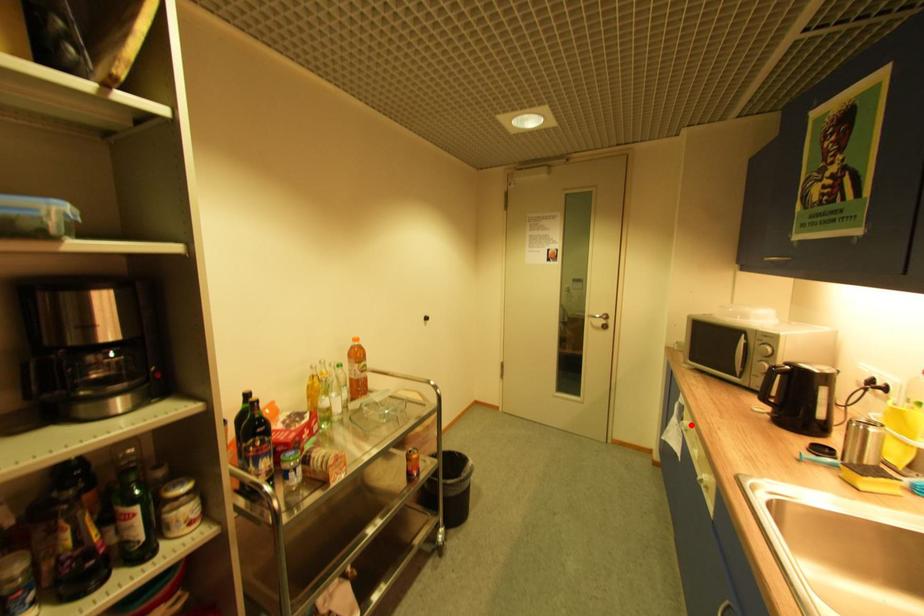
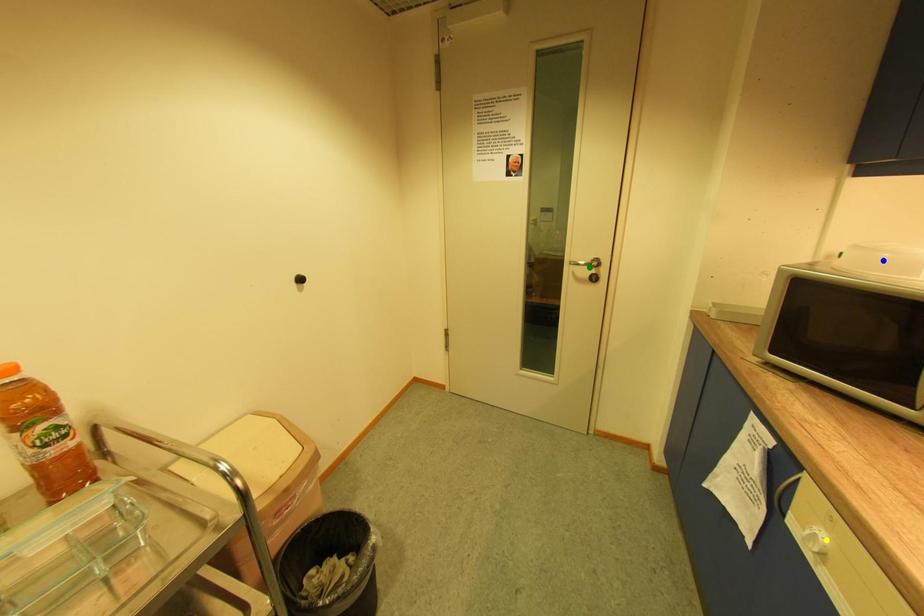
Question: I am providing you with two images of the same scene from different viewpoints. A red point is marked on the first image. You are given multiple points on the second image. Which point in image 2 is actually the same real-world point as the red point in image 1?

Choices:
 (A) green point
 (B) yellow point
 (C) blue point

Answer: (B)